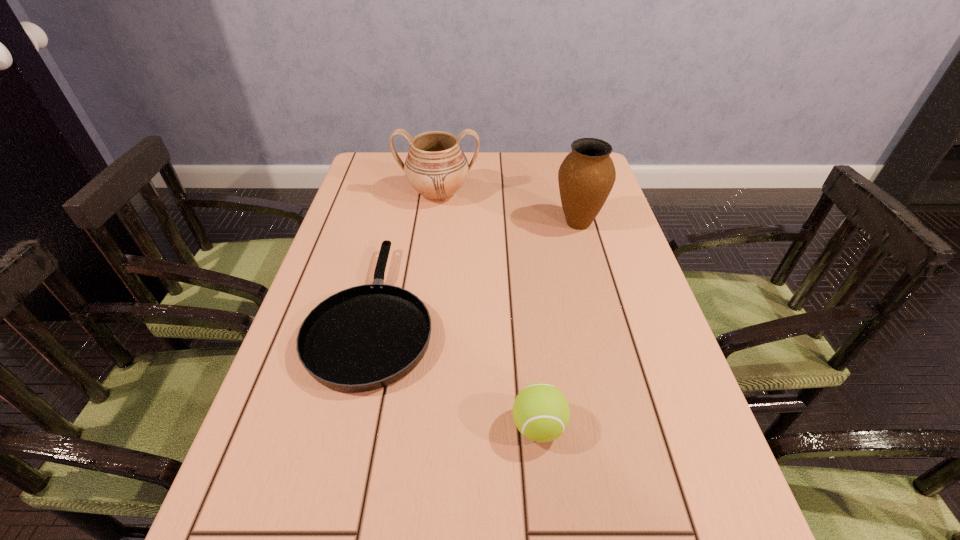
Identify the location of vacant space that's between the rightmost object and the third farthest object. (476, 268).

Locate an element on the screen. The width and height of the screenshot is (960, 540). empty space that is in between the left urn and the second object from right to left is located at coordinates click(x=489, y=310).

Locate an element on the screen. empty space that is in between the left urn and the rightmost object is located at coordinates (508, 208).

Locate an element on the screen. The height and width of the screenshot is (540, 960). empty location between the third farthest object and the left urn is located at coordinates (406, 253).

Locate an element on the screen. The height and width of the screenshot is (540, 960). vacant area that lies between the rightmost object and the second nearest object is located at coordinates (476, 268).

Find the location of `vacant space in between the left urn and the right urn`. vacant space in between the left urn and the right urn is located at coordinates (508, 208).

Identify the location of vacant area that lies between the left urn and the rightmost object. (508, 208).

At what (x,y) coordinates should I click in order to perform the action: click on vacant area that lies between the frying pan and the left urn. Please return your answer as a coordinate pair (x, y). Looking at the image, I should click on (406, 253).

You are a GUI agent. You are given a task and a screenshot of the screen. Output one action in this format:
    pyautogui.click(x=<x>, y=<y>)
    Task: Click on the free space between the second object from right to left and the shortest object
    
    Given the screenshot: What is the action you would take?
    pyautogui.click(x=457, y=370)

The height and width of the screenshot is (540, 960). Identify the location of free spot between the right urn and the left urn. [508, 208].